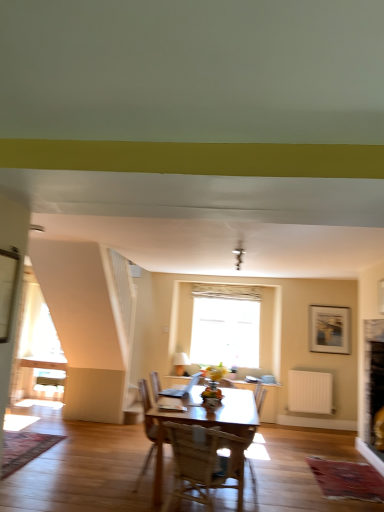
Question: Is white fabric lampshade at upper center smaller than white textured window at center?

Choices:
 (A) no
 (B) yes

Answer: (B)

Question: Is white fabric lampshade at upper center positioned in front of white textured window at center?

Choices:
 (A) yes
 (B) no

Answer: (A)

Question: From the image's perspective, is white fabric lampshade at upper center on top of white textured window at center?

Choices:
 (A) no
 (B) yes

Answer: (A)

Question: Is white fabric lampshade at upper center thinner than white textured window at center?

Choices:
 (A) yes
 (B) no

Answer: (A)

Question: From a real-world perspective, is white fabric lampshade at upper center on white textured window at center?

Choices:
 (A) no
 (B) yes

Answer: (A)

Question: Could you tell me if white fabric lampshade at upper center is facing white textured window at center?

Choices:
 (A) no
 (B) yes

Answer: (A)

Question: Is white textured window at center smaller than white fabric lampshade at upper center?

Choices:
 (A) no
 (B) yes

Answer: (A)

Question: Does white textured window at center have a lesser width compared to white fabric lampshade at upper center?

Choices:
 (A) no
 (B) yes

Answer: (A)

Question: Is white textured window at center wider than white fabric lampshade at upper center?

Choices:
 (A) yes
 (B) no

Answer: (A)

Question: Does white textured window at center turn towards white fabric lampshade at upper center?

Choices:
 (A) no
 (B) yes

Answer: (A)

Question: Is white textured window at center turned away from white fabric lampshade at upper center?

Choices:
 (A) yes
 (B) no

Answer: (B)

Question: Considering the relative sizes of white textured window at center and white fabric lampshade at upper center in the image provided, is white textured window at center taller than white fabric lampshade at upper center?

Choices:
 (A) no
 (B) yes

Answer: (B)

Question: Can you confirm if wooden framed picture at upper right is positioned to the right of white fabric lampshade at upper center?

Choices:
 (A) yes
 (B) no

Answer: (A)